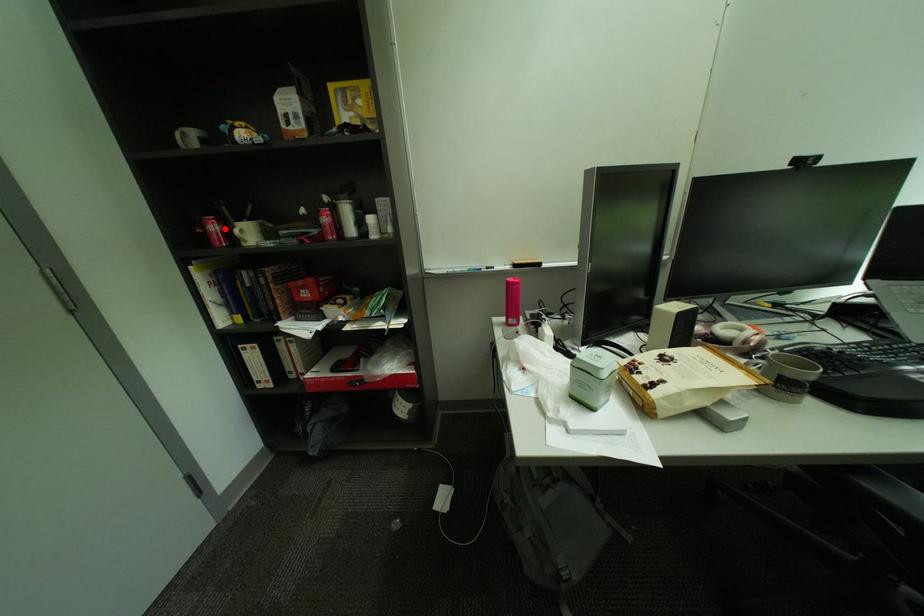
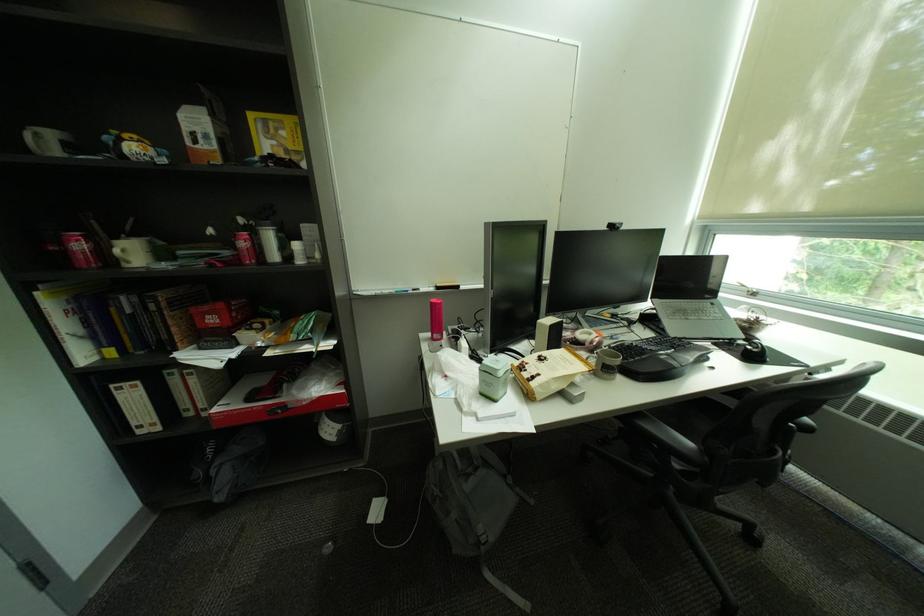
Locate, in the second image, the point that corresponds to the highlighted location in the first image.

(91, 246)